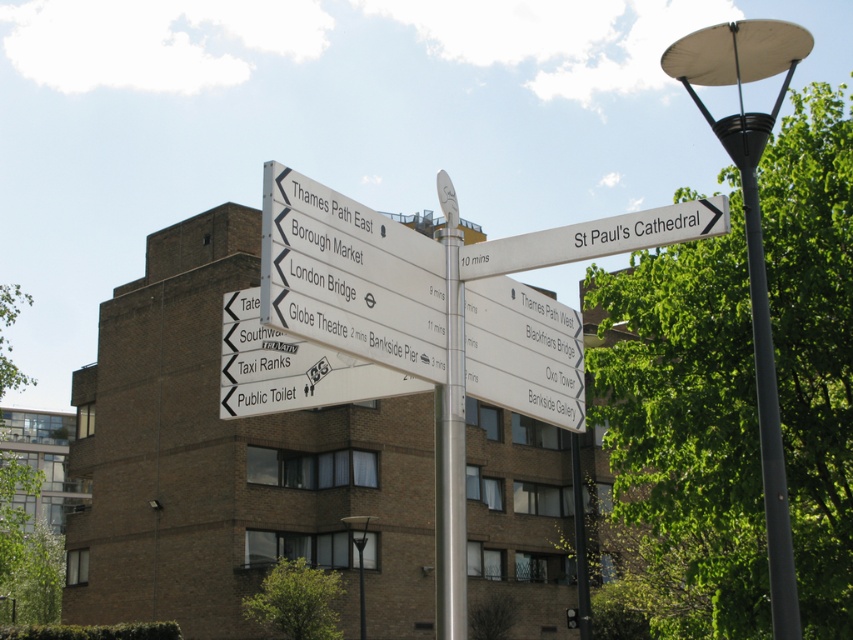
Is black metal lamp post at upper right thinner than silver metallic pole at center?

No, black metal lamp post at upper right is not thinner than silver metallic pole at center.

Does black metal lamp post at upper right have a greater width compared to silver metallic pole at center?

Correct, the width of black metal lamp post at upper right exceeds that of silver metallic pole at center.

Who is more distant from viewer, (761, 48) or (447, 300)?

The point (761, 48) is more distant.

Where is `black metal lamp post at upper right`? This screenshot has height=640, width=853. black metal lamp post at upper right is located at coordinates (753, 246).

Who is higher up, silver metallic pole at center or white plastic street sign at upper right?

white plastic street sign at upper right is above.

Measure the distance between silver metallic pole at center and camera.

silver metallic pole at center and camera are 34.09 feet apart from each other.

Identify the location of silver metallic pole at center. (450, 438).

Is black metal lamp post at upper right thinner than white plastic street sign at upper right?

No, black metal lamp post at upper right is not thinner than white plastic street sign at upper right.

Does point (764, 129) lie behind point (643, 234)?

Yes, it is behind point (643, 234).

The height and width of the screenshot is (640, 853). Identify the location of black metal lamp post at upper right. [753, 246].

I want to click on black metal lamp post at upper right, so click(753, 246).